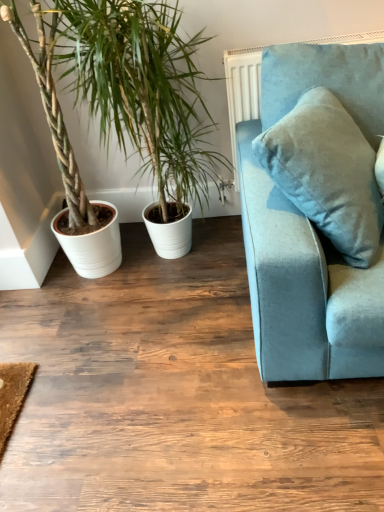
Question: Is white ceramic plant at left to the left or to the right of velvet blue couch at right in the image?

Choices:
 (A) right
 (B) left

Answer: (B)

Question: Considering the positions of point (142, 74) and point (354, 348), is point (142, 74) closer or farther from the camera than point (354, 348)?

Choices:
 (A) closer
 (B) farther

Answer: (B)

Question: In terms of height, does white ceramic plant at left look taller or shorter compared to velvet blue couch at right?

Choices:
 (A) short
 (B) tall

Answer: (B)

Question: Is velvet blue couch at right bigger or smaller than white ceramic plant at left?

Choices:
 (A) big
 (B) small

Answer: (B)

Question: From a real-world perspective, is velvet blue couch at right positioned above or below white ceramic plant at left?

Choices:
 (A) below
 (B) above

Answer: (B)

Question: In terms of height, does velvet blue couch at right look taller or shorter compared to white ceramic plant at left?

Choices:
 (A) short
 (B) tall

Answer: (A)

Question: Considering the positions of velvet blue couch at right and white ceramic plant at left in the image, is velvet blue couch at right wider or thinner than white ceramic plant at left?

Choices:
 (A) wide
 (B) thin

Answer: (B)